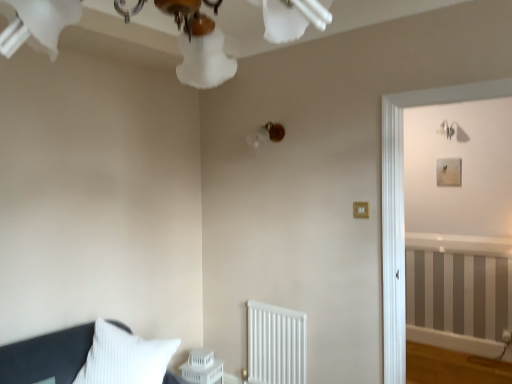
Question: Considering the relative positions of gold metallic light switch at center-right and white plastic table at lower center in the image provided, is gold metallic light switch at center-right to the left of white plastic table at lower center from the viewer's perspective?

Choices:
 (A) no
 (B) yes

Answer: (A)

Question: Is gold metallic light switch at center-right positioned with its back to white plastic table at lower center?

Choices:
 (A) yes
 (B) no

Answer: (B)

Question: Is gold metallic light switch at center-right wider than white plastic table at lower center?

Choices:
 (A) yes
 (B) no

Answer: (B)

Question: From the image's perspective, is gold metallic light switch at center-right above white plastic table at lower center?

Choices:
 (A) no
 (B) yes

Answer: (B)

Question: Is gold metallic light switch at center-right smaller than white plastic table at lower center?

Choices:
 (A) yes
 (B) no

Answer: (A)

Question: Is gold metallic light switch at center-right thinner than white plastic table at lower center?

Choices:
 (A) yes
 (B) no

Answer: (A)

Question: Is white frosted glass chandelier at upper center closer to the viewer compared to white plastic table at lower center?

Choices:
 (A) no
 (B) yes

Answer: (B)

Question: Is white frosted glass chandelier at upper center bigger than white plastic table at lower center?

Choices:
 (A) yes
 (B) no

Answer: (A)

Question: From a real-world perspective, is white frosted glass chandelier at upper center located higher than white plastic table at lower center?

Choices:
 (A) no
 (B) yes

Answer: (B)

Question: Is white frosted glass chandelier at upper center to the right of white plastic table at lower center from the viewer's perspective?

Choices:
 (A) yes
 (B) no

Answer: (A)

Question: Can you confirm if white frosted glass chandelier at upper center is positioned to the left of white plastic table at lower center?

Choices:
 (A) yes
 (B) no

Answer: (B)

Question: Does white frosted glass chandelier at upper center have a greater width compared to white plastic table at lower center?

Choices:
 (A) yes
 (B) no

Answer: (A)

Question: Is matte brown lampshade at upper center placed right next to white plastic table at lower center?

Choices:
 (A) yes
 (B) no

Answer: (B)